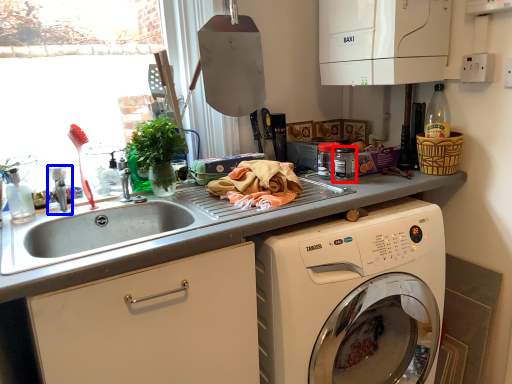
Question: Which point is further to the camera, appliance (highlighted by a red box) or faucet (highlighted by a blue box)?

Choices:
 (A) appliance
 (B) faucet

Answer: (A)